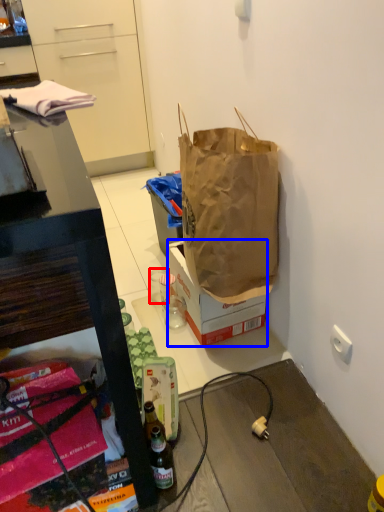
Question: Which object is further to the camera taking this photo, coffee cup (highlighted by a red box) or box (highlighted by a blue box)?

Choices:
 (A) coffee cup
 (B) box

Answer: (A)